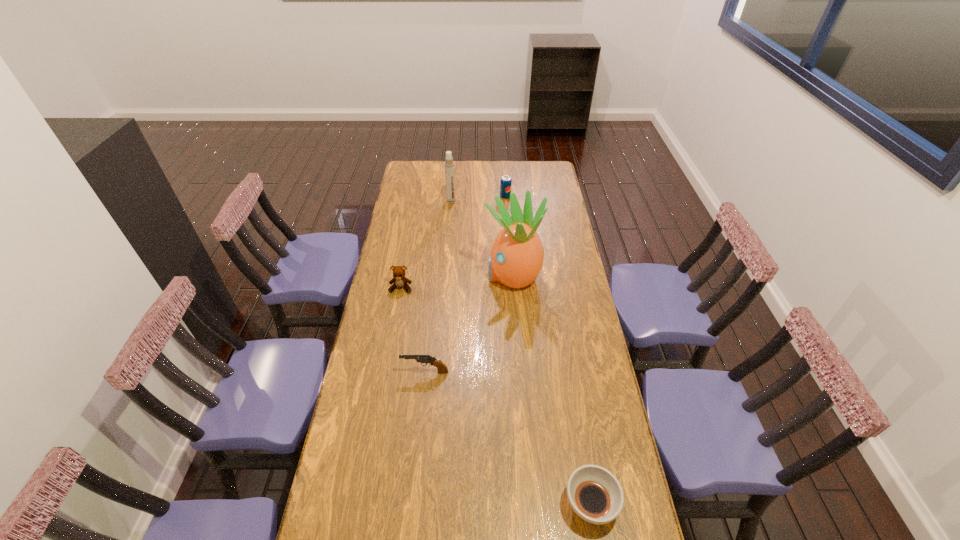
Where is `free point located 0.200m on the right of the aerosol can`? The width and height of the screenshot is (960, 540). free point located 0.200m on the right of the aerosol can is located at coordinates (492, 201).

Locate an element on the screen. vacant space situated 0.200m on the front-facing side of the teddy bear is located at coordinates (394, 330).

Where is `free space located 0.250m on the left of the pop soda`? The height and width of the screenshot is (540, 960). free space located 0.250m on the left of the pop soda is located at coordinates (454, 196).

At what (x,y) coordinates should I click in order to perform the action: click on vacant space situated along the barrel of the second nearest object. Please return your answer as a coordinate pair (x, y). Looking at the image, I should click on (374, 372).

At what (x,y) coordinates should I click in order to perform the action: click on vacant space located 0.110m along the barrel of the second nearest object. Please return your answer as a coordinate pair (x, y). The height and width of the screenshot is (540, 960). Looking at the image, I should click on (372, 372).

I want to click on vacant area situated 0.100m along the barrel of the second nearest object, so click(x=374, y=372).

This screenshot has height=540, width=960. Identify the location of vacant space located 0.330m on the left of the soup bowl. (450, 504).

Find the location of a particular element. teddy bear that is at the left edge is located at coordinates (399, 280).

The image size is (960, 540). I want to click on gun located at the left edge, so click(441, 367).

Locate an element on the screen. Image resolution: width=960 pixels, height=540 pixels. object that is positioned at the right edge is located at coordinates (594, 493).